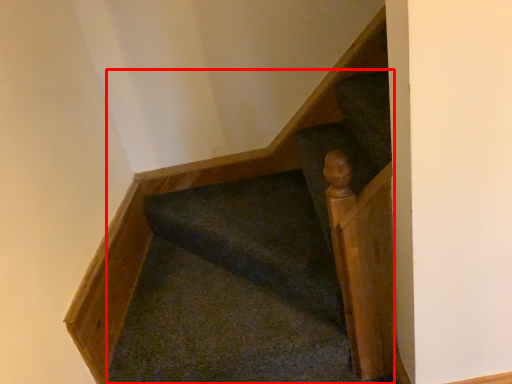
Question: In this image, where is stairs (annotated by the red box) located relative to rail?

Choices:
 (A) right
 (B) left

Answer: (B)